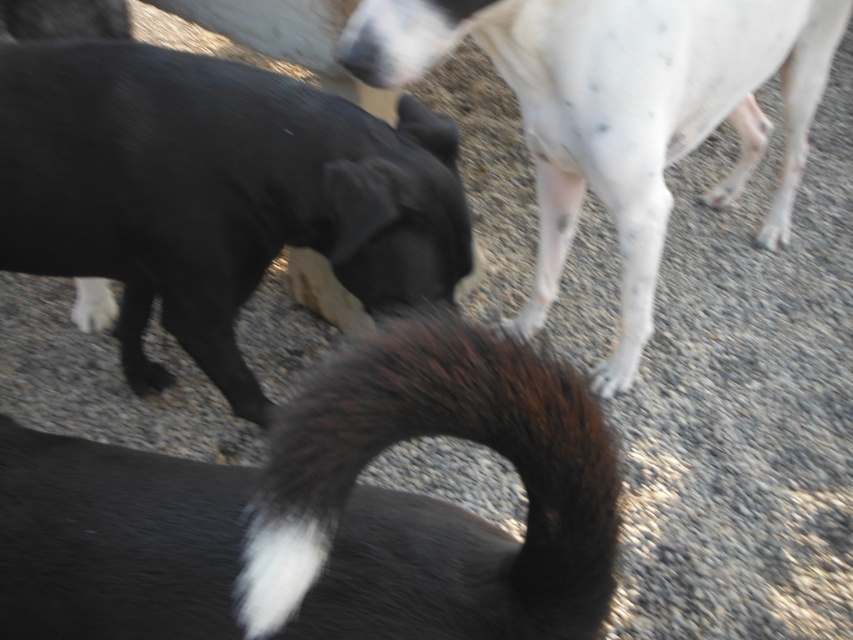
Does matte black dog at left come in front of white speckled fur at upper right?

No.

Is matte black dog at left above white speckled fur at upper right?

No, matte black dog at left is not above white speckled fur at upper right.

Is point (222, 353) farther from camera compared to point (654, 179)?

That is False.

This screenshot has width=853, height=640. I want to click on matte black dog at left, so click(213, 192).

Can you confirm if black fur tail at center is positioned below matte black dog at left?

Yes, black fur tail at center is below matte black dog at left.

Can you confirm if black fur tail at center is taller than matte black dog at left?

No.

Describe the element at coordinates (325, 509) in the screenshot. Image resolution: width=853 pixels, height=640 pixels. I see `black fur tail at center` at that location.

Find the location of a particular element. black fur tail at center is located at coordinates (325, 509).

Which is more to the right, black fur tail at center or white speckled fur at upper right?

From the viewer's perspective, white speckled fur at upper right appears more on the right side.

Does black fur tail at center have a greater width compared to white speckled fur at upper right?

Incorrect, black fur tail at center's width does not surpass white speckled fur at upper right's.

Is point (508, 451) closer to viewer compared to point (737, 193)?

Yes, point (508, 451) is in front of point (737, 193).

Locate an element on the screen. The height and width of the screenshot is (640, 853). black fur tail at center is located at coordinates (325, 509).